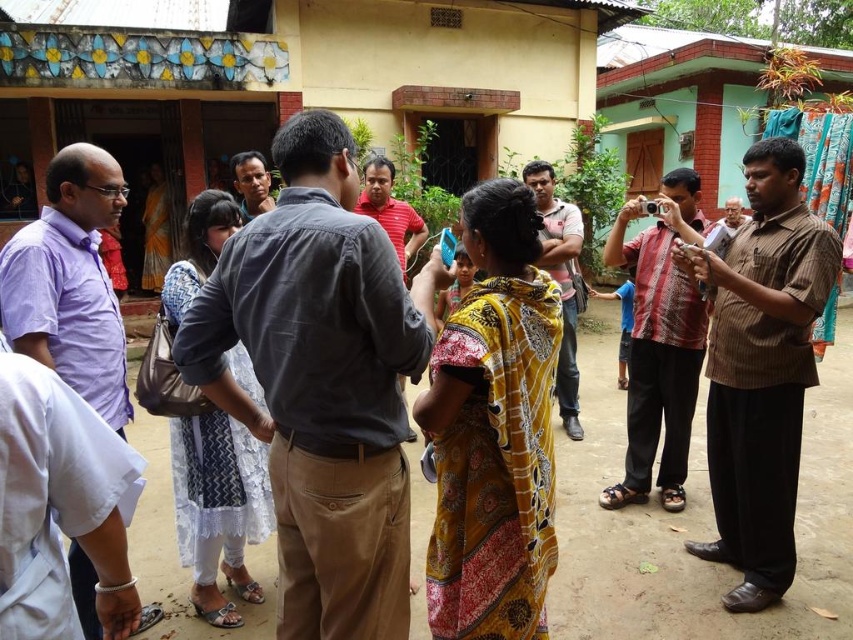
Question: Which object appears closest to the camera in this image?

Choices:
 (A) brown striped shirt at right
 (B) light brown shirt at center

Answer: (A)

Question: Which point is farther to the camera?

Choices:
 (A) brown striped shirt at right
 (B) reddish-brown woven shirt at center
 (C) dark gray corduroy shirt at center
 (D) matte black shirt at center

Answer: (D)

Question: In this image, where is dark gray corduroy shirt at center located relative to purple cotton shirt at center?

Choices:
 (A) below
 (B) above

Answer: (A)

Question: From the image, what is the correct spatial relationship of brown striped shirt at right in relation to purple cotton shirt at center?

Choices:
 (A) above
 (B) below

Answer: (B)

Question: In this image, where is dark gray corduroy shirt at center located relative to purple cotton shirt at center?

Choices:
 (A) right
 (B) left

Answer: (A)

Question: Which point appears farthest from the camera in this image?

Choices:
 (A) (561, 426)
 (B) (639, 339)

Answer: (A)